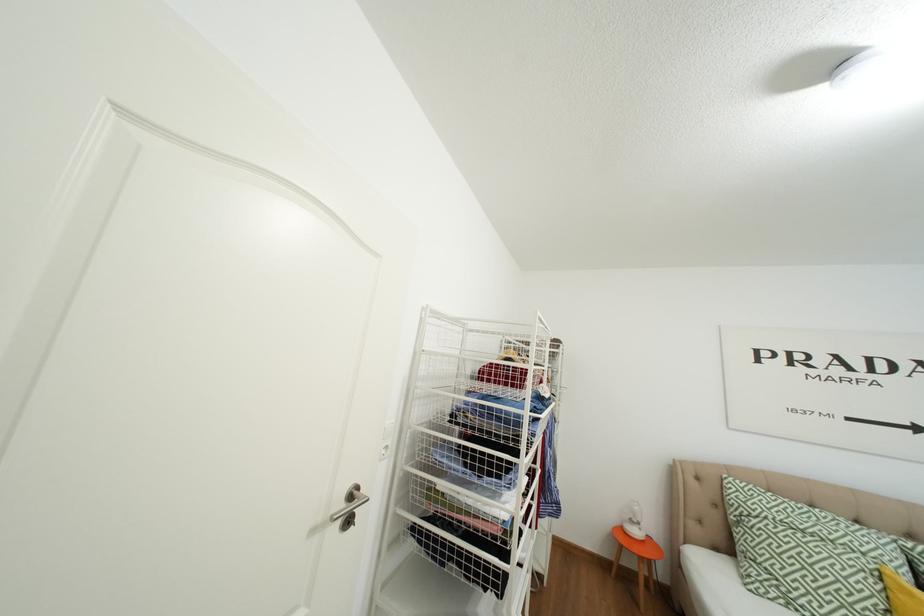
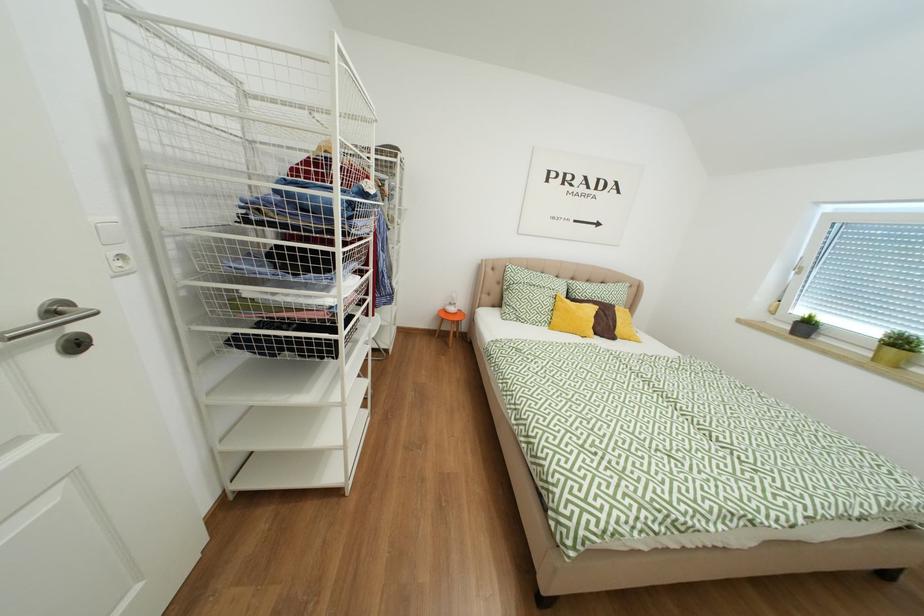
The images are taken continuously from a first-person perspective. In which direction is your viewpoint rotating?

The rotation direction of the camera is right-down.